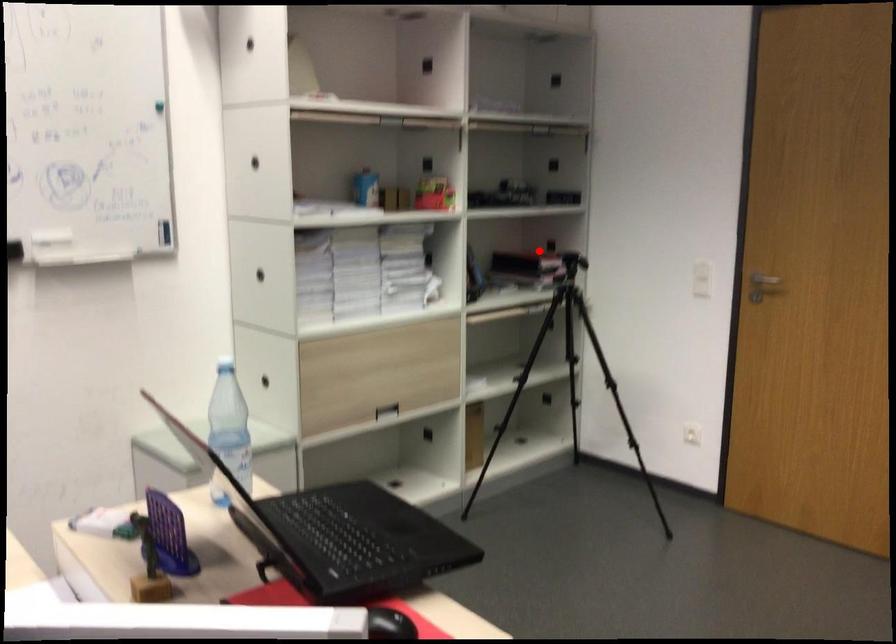
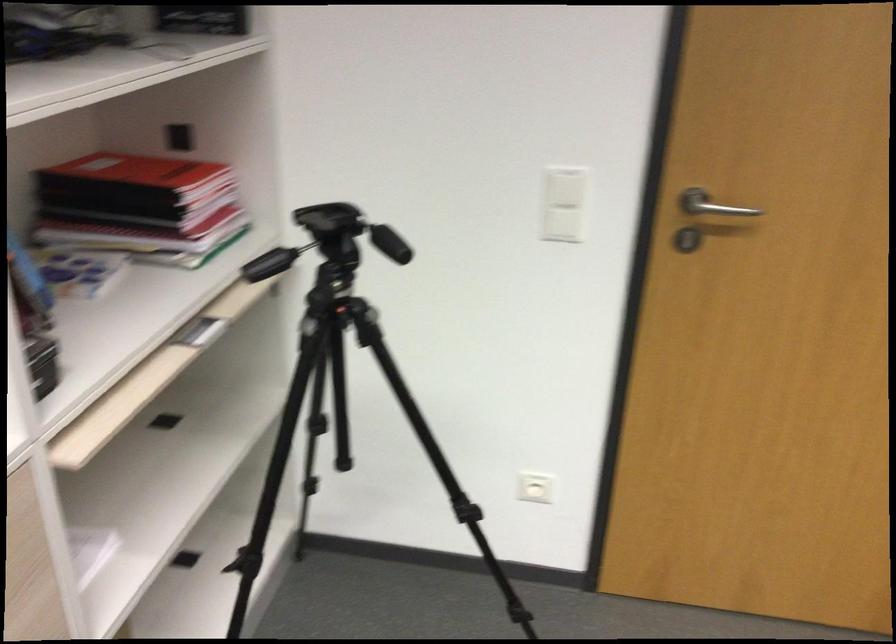
Question: I am providing you with two images of the same scene from different viewpoints. Image1 has a red point marked. In image2, the corresponding 3D location appears at what relative position? Reply with the corresponding letter.

Choices:
 (A) Closer
 (B) Farther

Answer: (A)